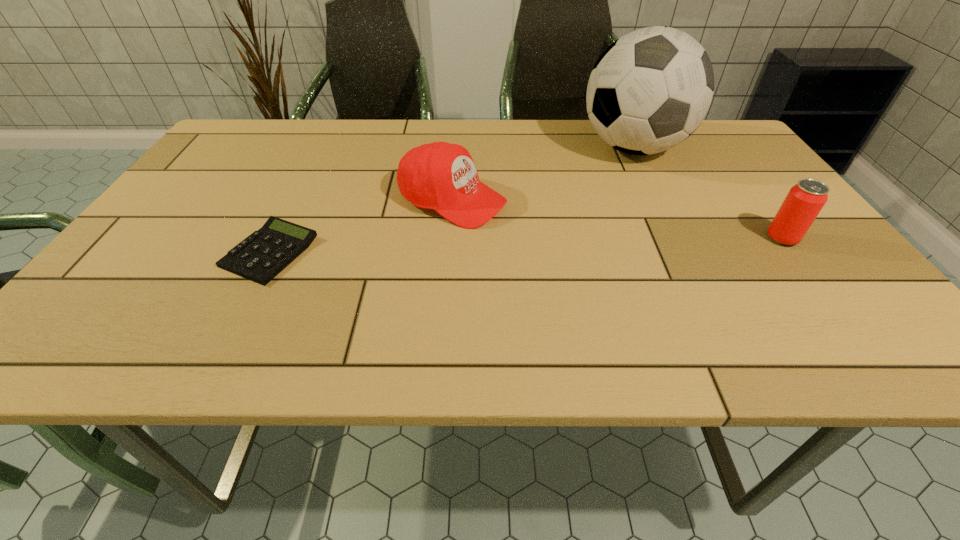
Image resolution: width=960 pixels, height=540 pixels. In the image, there is a desktop. What are the coordinates of `vacant region at the near edge` in the screenshot? It's located at (744, 287).

What are the coordinates of `vacant space at the left edge of the desktop` in the screenshot? It's located at (204, 212).

In the image, there is a desktop. Where is `vacant space at the right edge`? Image resolution: width=960 pixels, height=540 pixels. vacant space at the right edge is located at coordinates (708, 183).

Locate an element on the screen. This screenshot has width=960, height=540. free region at the far left corner of the desktop is located at coordinates (255, 131).

Identify the location of vacant area at the near right corner of the desktop. (800, 298).

I want to click on free space between the baseball cap and the beer can, so click(617, 219).

I want to click on vacant area that lies between the baseball cap and the beer can, so click(617, 219).

This screenshot has height=540, width=960. In order to click on vacant space that's between the rightmost object and the shortest object in this screenshot , I will do `click(526, 245)`.

At what (x,y) coordinates should I click in order to perform the action: click on vacant area that lies between the soccer ball and the third object from right to left. Please return your answer as a coordinate pair (x, y). Looking at the image, I should click on (542, 174).

Find the location of a particular element. This screenshot has width=960, height=540. free space between the tallest object and the rightmost object is located at coordinates (708, 193).